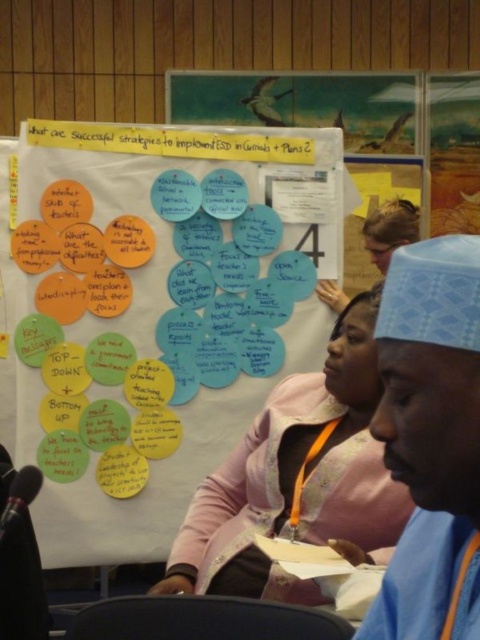
Question: Is pink fabric jacket at center to the left of white paper poster at upper center from the viewer's perspective?

Choices:
 (A) no
 (B) yes

Answer: (B)

Question: Does blue fabric cap at upper right lie behind white paper poster at upper center?

Choices:
 (A) yes
 (B) no

Answer: (B)

Question: Is pink fabric jacket at center to the left of wooden frame at upper right from the viewer's perspective?

Choices:
 (A) no
 (B) yes

Answer: (B)

Question: Which point is closer to the camera?

Choices:
 (A) white paper poster at upper center
 (B) blue fabric cap at upper right
 (C) wooden frame at upper right

Answer: (B)

Question: Which point is farther to the camera?

Choices:
 (A) (388, 524)
 (B) (468, 458)
 (C) (104, 163)

Answer: (C)

Question: Which point is farther to the camera?

Choices:
 (A) wooden frame at upper right
 (B) white paper poster at upper center
 (C) yellow paper circles at upper center

Answer: (A)